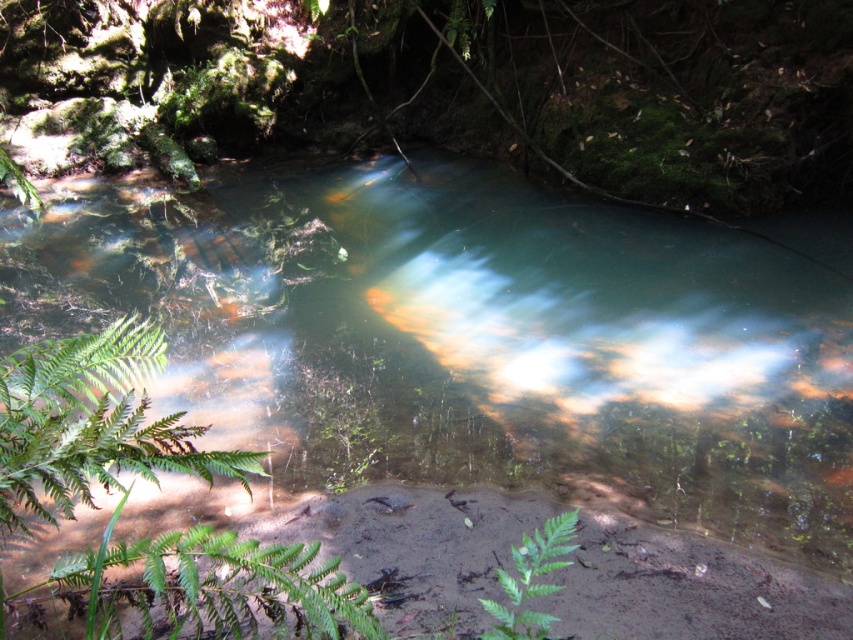
Does point (61, 406) come farther from viewer compared to point (503, 614)?

Yes, point (61, 406) is behind point (503, 614).

Is green leafy fern at lower left bigger than green leafy fern at lower center?

Correct, green leafy fern at lower left is larger in size than green leafy fern at lower center.

Identify the location of green leafy fern at lower left. The height and width of the screenshot is (640, 853). (91, 424).

Does point (318, 346) come in front of point (86, 336)?

No.

Is clear water stream at center positioned behind green leafy fern at lower left?

Yes, it is.

Between point (689, 435) and point (32, 432), which one is positioned in front?

Positioned in front is point (32, 432).

Identify the location of clear water stream at center. (473, 339).

Can you confirm if clear water stream at center is taller than green leafy fern at lower center?

Yes, clear water stream at center is taller than green leafy fern at lower center.

Who is lower down, clear water stream at center or green leafy fern at lower center?

Positioned lower is green leafy fern at lower center.

Between point (250, 300) and point (561, 548), which one is positioned behind?

Point (250, 300)

Find the location of a particular element. The width and height of the screenshot is (853, 640). clear water stream at center is located at coordinates (473, 339).